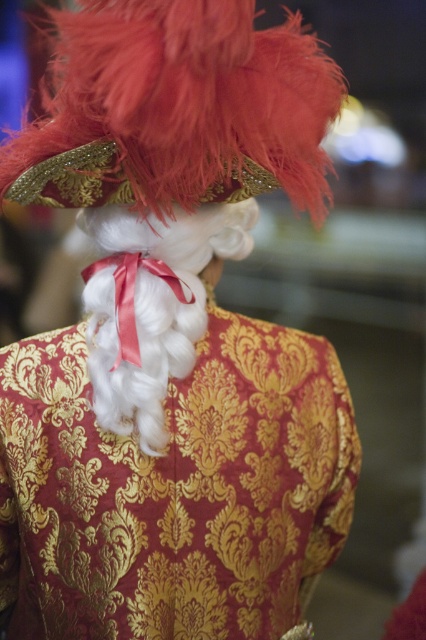
Does feathered gold hat at upper center have a lesser width compared to white silky wig at center?

No.

Between feathered gold hat at upper center and white silky wig at center, which one has less height?

feathered gold hat at upper center

Locate an element on the screen. This screenshot has height=640, width=426. feathered gold hat at upper center is located at coordinates (176, 109).

Find the location of a particular element. feathered gold hat at upper center is located at coordinates (176, 109).